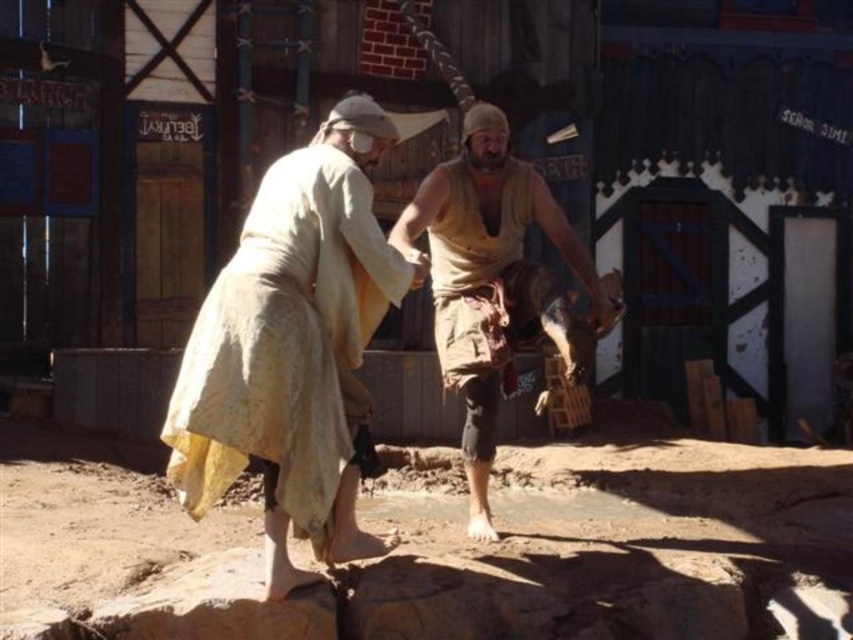
Question: Is light beige fabric dress at center further to the viewer compared to brown rough fabric shirt at center?

Choices:
 (A) no
 (B) yes

Answer: (A)

Question: Which object appears closest to the camera in this image?

Choices:
 (A) light beige fabric dress at center
 (B) brown rough fabric shirt at center

Answer: (A)

Question: Which point is closer to the camera?

Choices:
 (A) (373, 300)
 (B) (473, 364)

Answer: (A)

Question: Can you confirm if light beige fabric dress at center is smaller than brown rough fabric shirt at center?

Choices:
 (A) no
 (B) yes

Answer: (A)

Question: Which object is closer to the camera taking this photo?

Choices:
 (A) light beige fabric dress at center
 (B) brown rough fabric shirt at center

Answer: (A)

Question: Is light beige fabric dress at center thinner than brown rough fabric shirt at center?

Choices:
 (A) yes
 (B) no

Answer: (A)